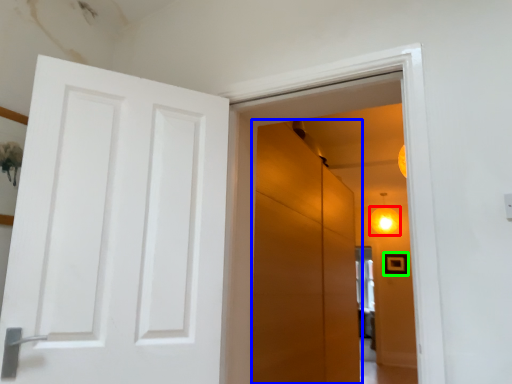
Question: Based on their relative distances, which object is nearer to lighting (highlighted by a red box)? Choose from screen door (highlighted by a blue box) and picture frame (highlighted by a green box).

Choices:
 (A) screen door
 (B) picture frame

Answer: (B)